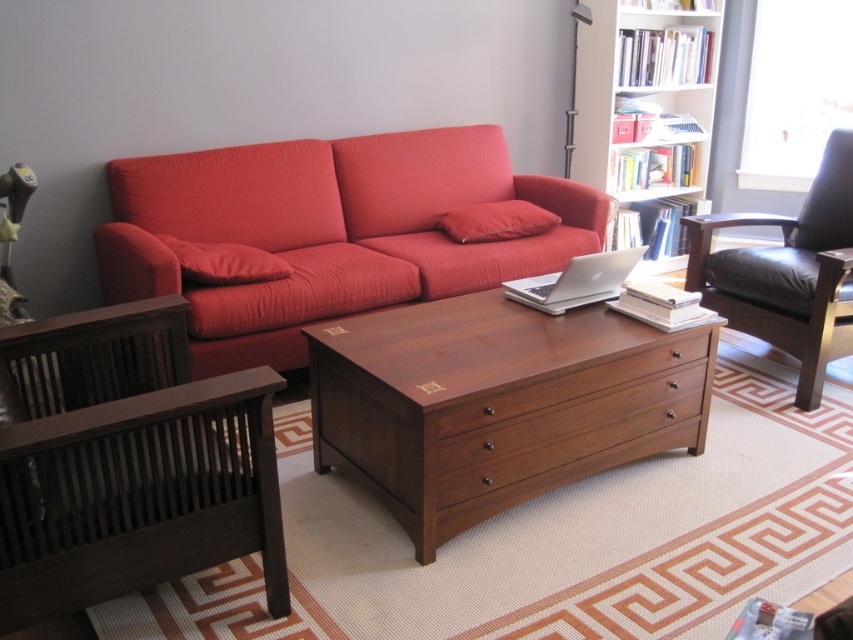
You are a guest entering the living room and want to sit down. You see the brown wood coffee table at center and the dark brown wood armchair at left. Which object is closer to you as you enter?

The brown wood coffee table at center is closer to you because it is further to the viewer than the dark brown wood armchair at left, meaning it appears nearer in the scene.

You are standing in the living room and notice two points marked in the scene. Which point is closer to you, point (x=434, y=390) or point (x=160, y=484)?

Point (x=434, y=390) is further to the viewer than point (x=160, y=484), so point (x=160, y=484) is closer to you.